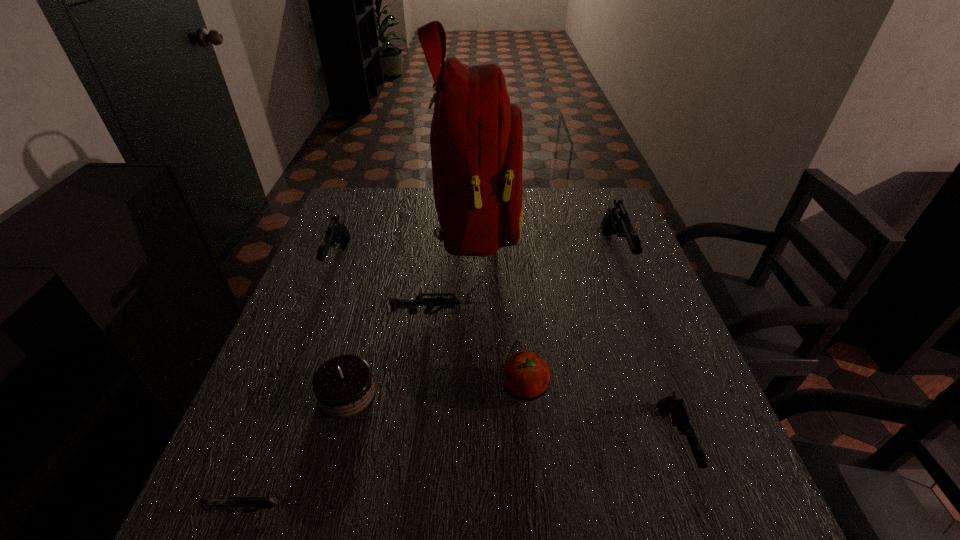
In order to click on the right grey gun in this screenshot , I will do `click(395, 303)`.

This screenshot has height=540, width=960. What are the coordinates of `the fourth tallest gun` in the screenshot? It's located at (395, 303).

The width and height of the screenshot is (960, 540). Identify the location of the left grey gun. (246, 503).

Where is `the shortest object`? the shortest object is located at coordinates (246, 503).

What are the coordinates of `vacant area situated 0.130m on the front-facing side of the tallest object` in the screenshot? It's located at (564, 223).

What are the coordinates of `free space located 0.190m at the end of the barrel of the seventh shortest object` in the screenshot? It's located at (648, 344).

Where is `vacant region located at the end of the barrel of the second smallest black gun`? The width and height of the screenshot is (960, 540). vacant region located at the end of the barrel of the second smallest black gun is located at coordinates (305, 347).

Identify the location of free spot located 0.220m on the left of the apple. (392, 389).

I want to click on vacant position located 0.130m on the front of the chocolate cake, so click(x=323, y=486).

This screenshot has height=540, width=960. Find the location of `free location located at the end of the barrel of the smallest black gun`. free location located at the end of the barrel of the smallest black gun is located at coordinates (704, 524).